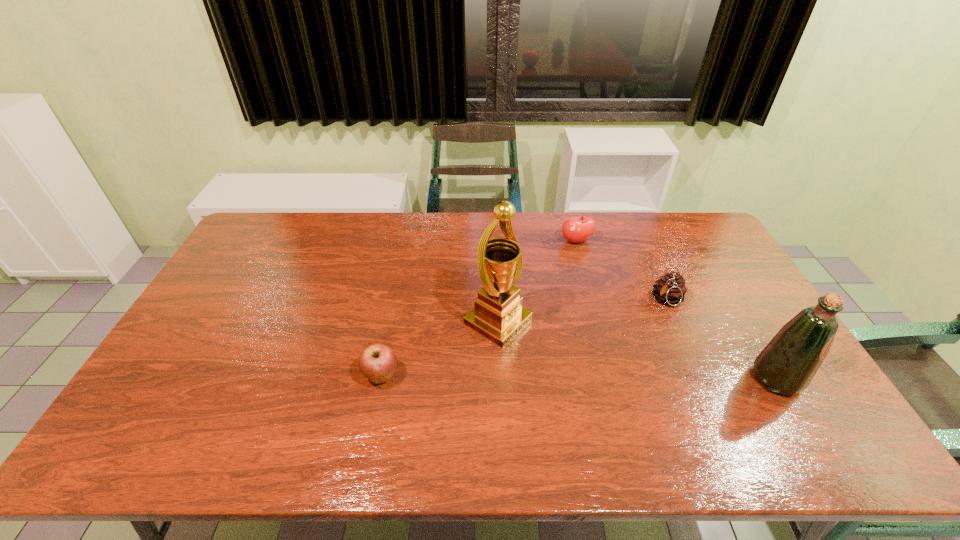
This screenshot has width=960, height=540. I want to click on free space located 0.370m with a leaf charm attached to the pinecone, so click(x=602, y=390).

Identify the location of vacant region located 0.180m with a leaf charm attached to the pinecone. The height and width of the screenshot is (540, 960). (635, 346).

Identify the location of free location located with a leaf charm attached to the pinecone. (641, 338).

This screenshot has width=960, height=540. What are the coordinates of `vacant space located on the stem of the farthest object` in the screenshot? It's located at (603, 332).

Find the location of a particular element. free region located 0.260m on the stem of the farthest object is located at coordinates (593, 300).

Find the location of a particular element. This screenshot has width=960, height=540. blank space located 0.050m on the stem of the farthest object is located at coordinates (581, 258).

Find the location of a particular element. This screenshot has width=960, height=540. blank space located on the front-facing side of the tallest object is located at coordinates [612, 390].

This screenshot has width=960, height=540. Identify the location of blank space located on the front-facing side of the tallest object. (597, 382).

Where is `free space located on the front-facing side of the tallest object`? free space located on the front-facing side of the tallest object is located at coordinates (574, 368).

You are a GUI agent. You are given a task and a screenshot of the screen. Output one action in this format:
    pyautogui.click(x=<x>, y=<y>)
    Task: Click on the object that is at the far edge
    The width and height of the screenshot is (960, 540).
    Given the screenshot: What is the action you would take?
    pyautogui.click(x=578, y=229)